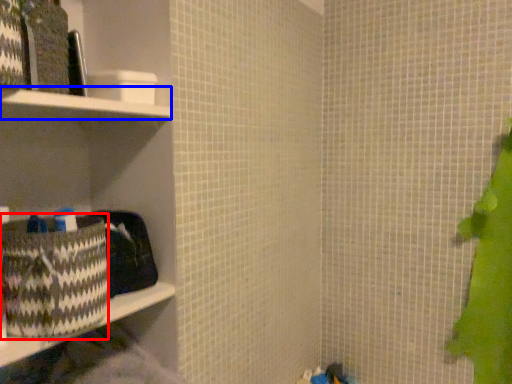
Question: Among these objects, which one is farthest to the camera, waste (highlighted by a red box) or cabinet (highlighted by a blue box)?

Choices:
 (A) waste
 (B) cabinet

Answer: (A)